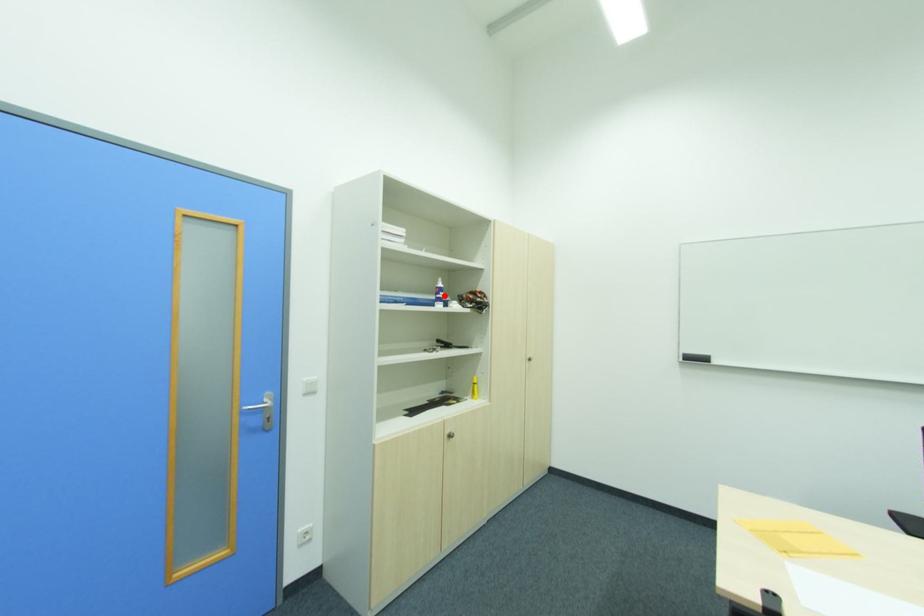
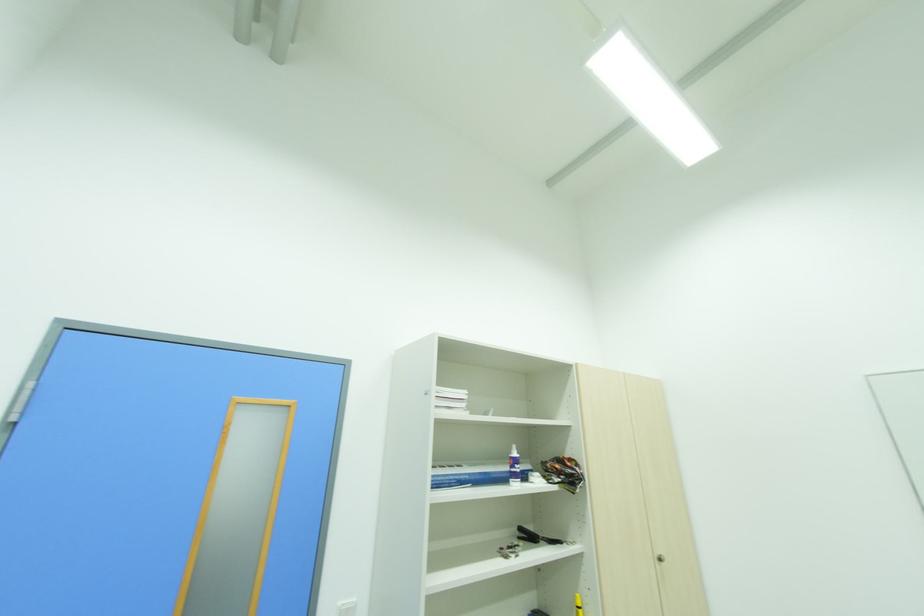
In the second image, find the point that corresponds to the highlighted location in the first image.

(520, 469)